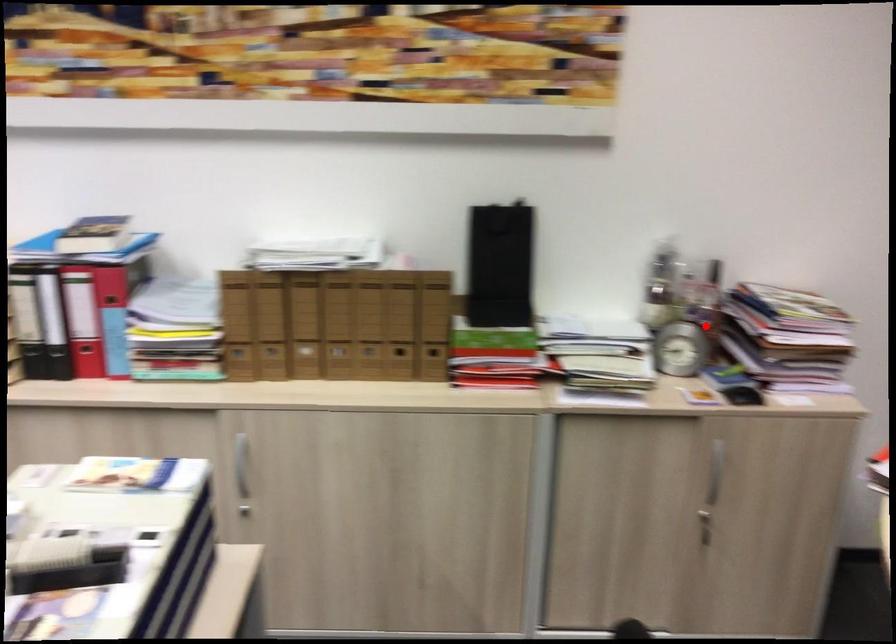
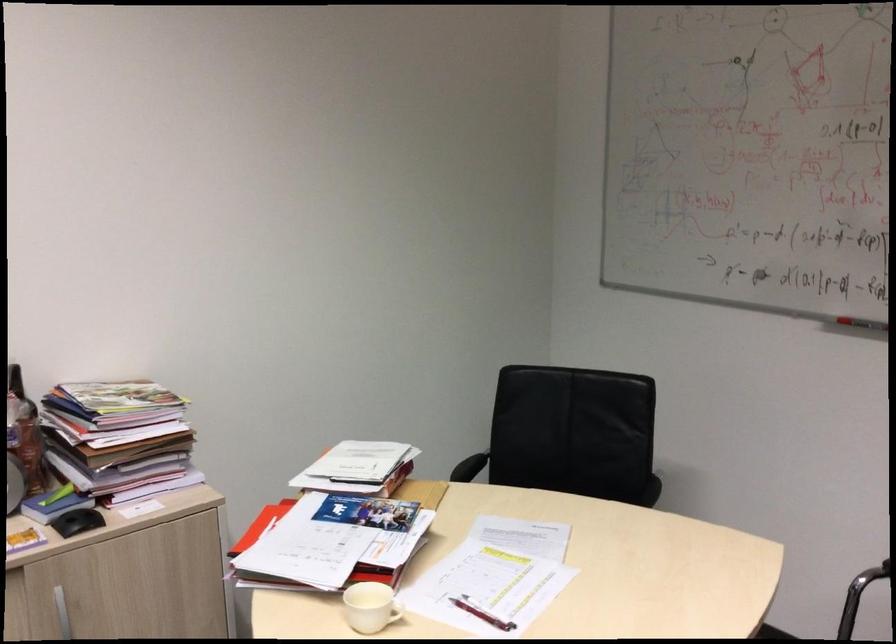
Find the pixel in the second image that matches the highlighted location in the first image.

(23, 450)